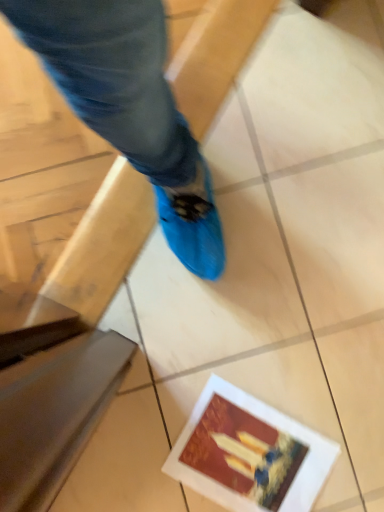
Identify the location of free area in between matte paper postcard at lower right and smooth beige tile at lower left. pyautogui.click(x=142, y=448).